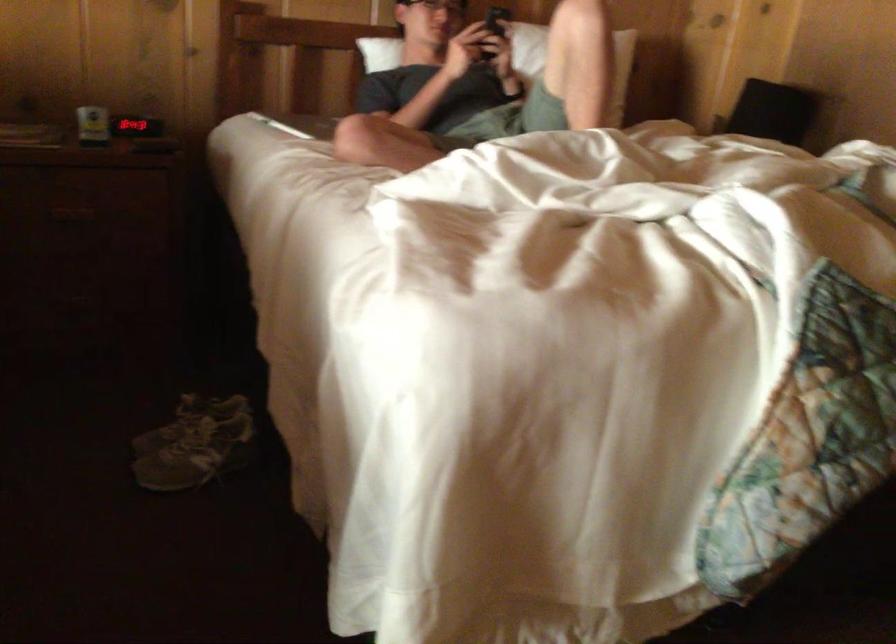
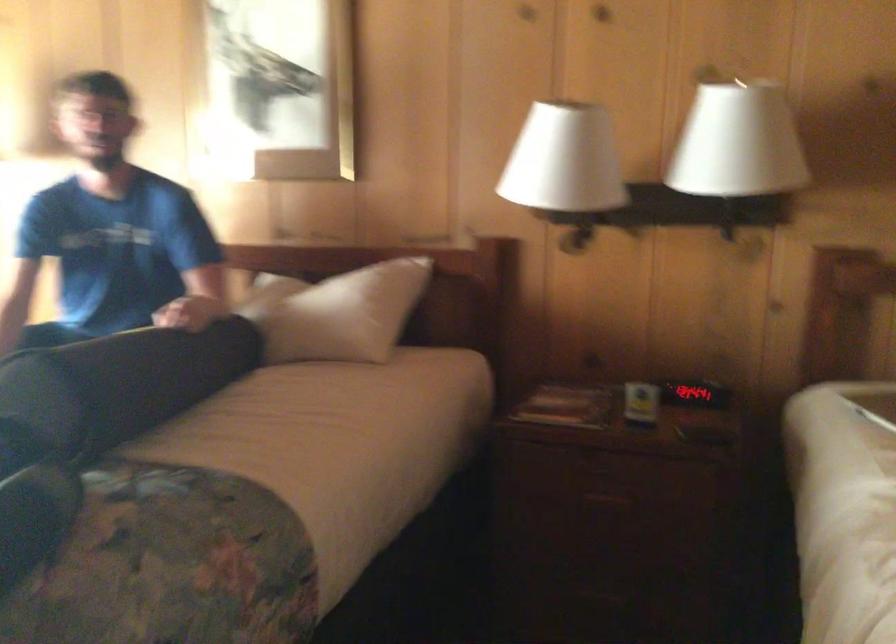
Question: The camera is either moving clockwise (left) or counter-clockwise (right) around the object. The first image is from the beginning of the video and the second image is from the end. Is the camera moving left or right when shooting the video?

Choices:
 (A) Left
 (B) Right

Answer: (B)